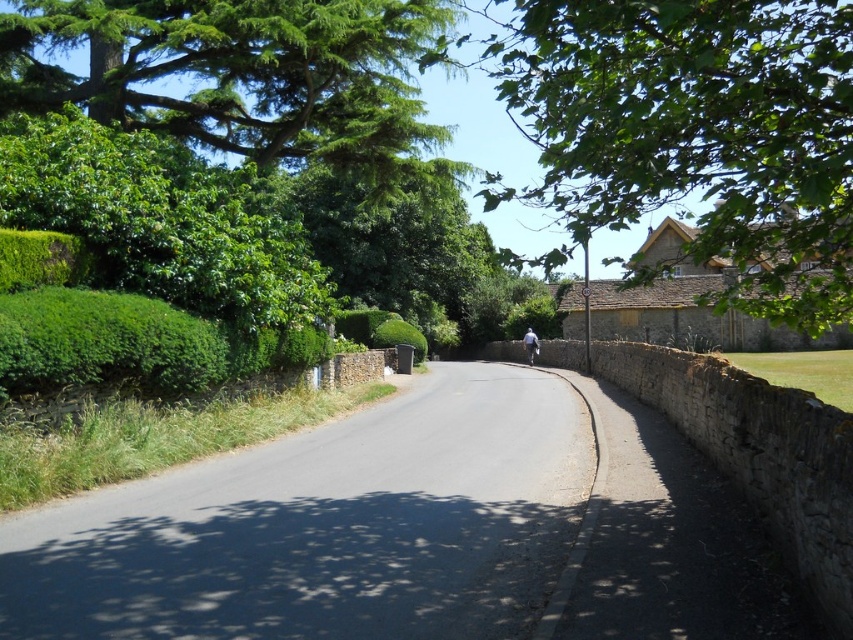
You are a photographer planning to take a photo of the light blue fabric at center and the green leafy tree at upper right. Which object would cast a shadow over the other?

The green leafy tree at upper right is positioned over the light blue fabric at center, so its shadow would fall onto the fabric.

You are standing at the camera position and want to reach the point at coordinates (837, 280). If your walking speed is 1.5 meters per second, how many seconds will it take you to reach that point?

The distance between you and the point at coordinates (837, 280) is 7.96 meters. At a walking speed of 1.5 meters per second, it will take approximately 5.31 seconds to reach the point.

You are standing at the center of the road in the rural scene. Looking towards the upper right corner, can you see the green leafy tree at upper right? Please explain based on its position.

Yes, the green leafy tree at upper right is located at point [694,132] in the image, which places it in the upper right corner area. Since you are at the center of the road facing that direction, it should be visible.